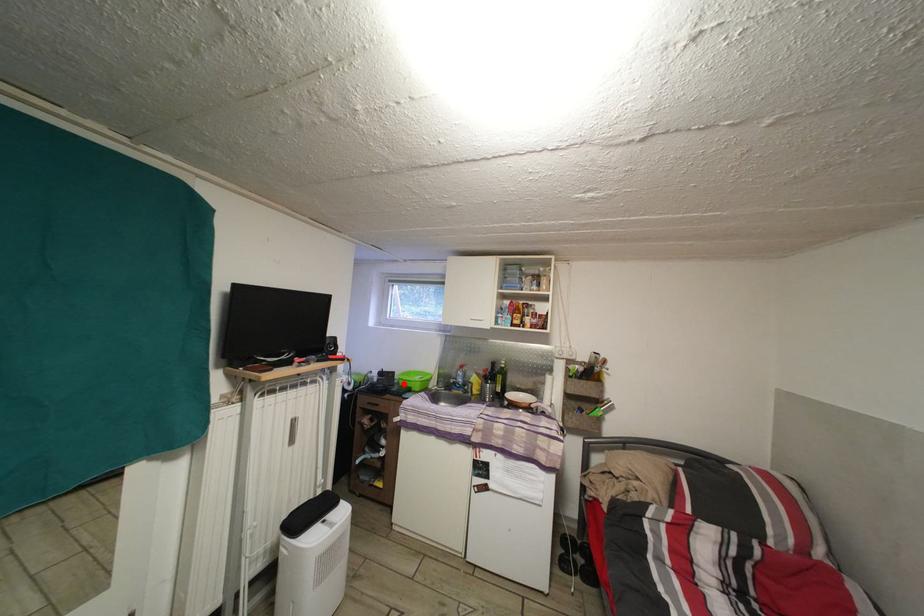
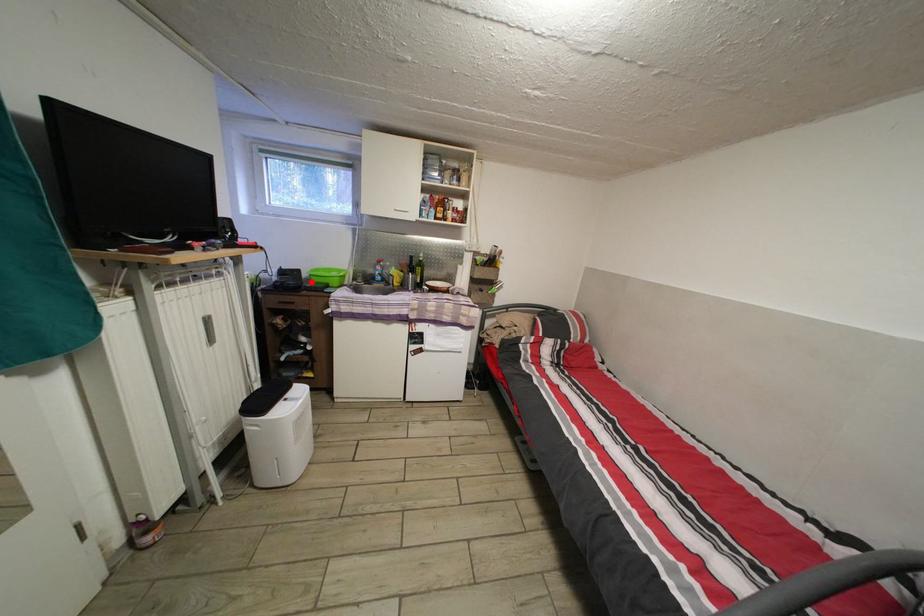
I am providing you with two images of the same scene from different viewpoints. A red point is marked on the first image and another point is marked on the second image. Does the point marked in image1 correspond to the same location as the one in image2?

Yes